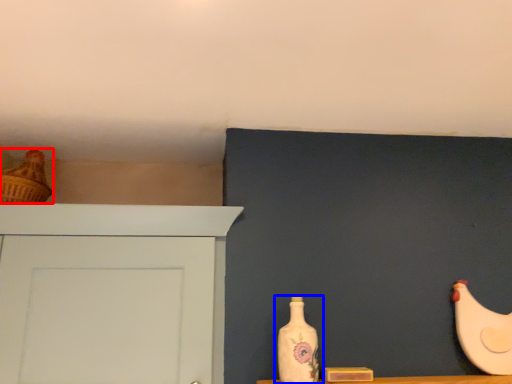
Question: Which object appears closest to the camera in this image, chicken (highlighted by a red box) or bottle (highlighted by a blue box)?

Choices:
 (A) chicken
 (B) bottle

Answer: (B)